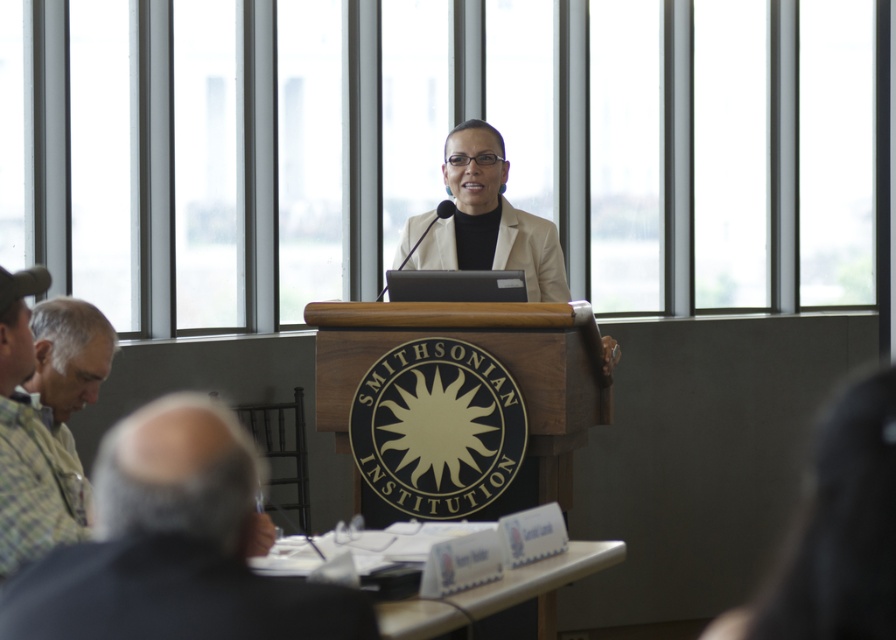
Question: Among these objects, which one is nearest to the camera?

Choices:
 (A) gray fabric shirt at lower left
 (B) smooth black hair at center
 (C) green plaid shirt at lower left

Answer: (A)

Question: Which point is closer to the camera?

Choices:
 (A) (862, 465)
 (B) (97, 340)

Answer: (A)

Question: Among these points, which one is farthest from the camera?

Choices:
 (A) (71, 385)
 (B) (195, 480)

Answer: (A)

Question: Can you confirm if gray fabric shirt at lower left is positioned to the left of smooth black hair at center?

Choices:
 (A) no
 (B) yes

Answer: (B)

Question: Can you confirm if smooth black hair at center is positioned above green plaid shirt at lower left?

Choices:
 (A) no
 (B) yes

Answer: (A)

Question: From the image, what is the correct spatial relationship of smooth black hair at center in relation to green plaid shirt at lower left?

Choices:
 (A) right
 (B) left

Answer: (A)